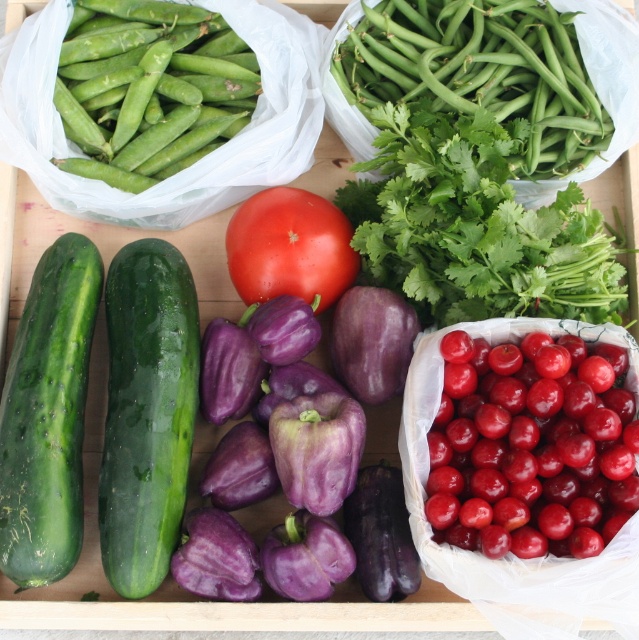
Who is positioned more to the left, green smooth cucumber at left or green matte pod at upper left?

green matte pod at upper left

Consider the image. Which is below, green smooth cucumber at left or green matte pod at upper left?

green smooth cucumber at left

This screenshot has width=639, height=640. Describe the element at coordinates (146, 412) in the screenshot. I see `green smooth cucumber at left` at that location.

You are a GUI agent. You are given a task and a screenshot of the screen. Output one action in this format:
    pyautogui.click(x=<x>, y=<y>)
    Task: Click on the green smooth cucumber at left
    
    Given the screenshot: What is the action you would take?
    pyautogui.click(x=146, y=412)

Is shiny red cherries at center right wider than red matte tomato at center?

Yes, shiny red cherries at center right is wider than red matte tomato at center.

Is point (472, 472) behind point (243, 256)?

No.

At what (x,y) coordinates should I click in order to perform the action: click on shiny red cherries at center right. Please return your answer as a coordinate pair (x, y). This screenshot has height=640, width=639. Looking at the image, I should click on (532, 448).

Consider the image. Is green smooth cucumber at left above red matte tomato at center?

Incorrect, green smooth cucumber at left is not positioned above red matte tomato at center.

Is the position of green smooth cucumber at left more distant than that of red matte tomato at center?

No, green smooth cucumber at left is in front of red matte tomato at center.

At what (x,y) coordinates should I click in order to perform the action: click on green smooth cucumber at left. Please return your answer as a coordinate pair (x, y). Image resolution: width=639 pixels, height=640 pixels. Looking at the image, I should click on (146, 412).